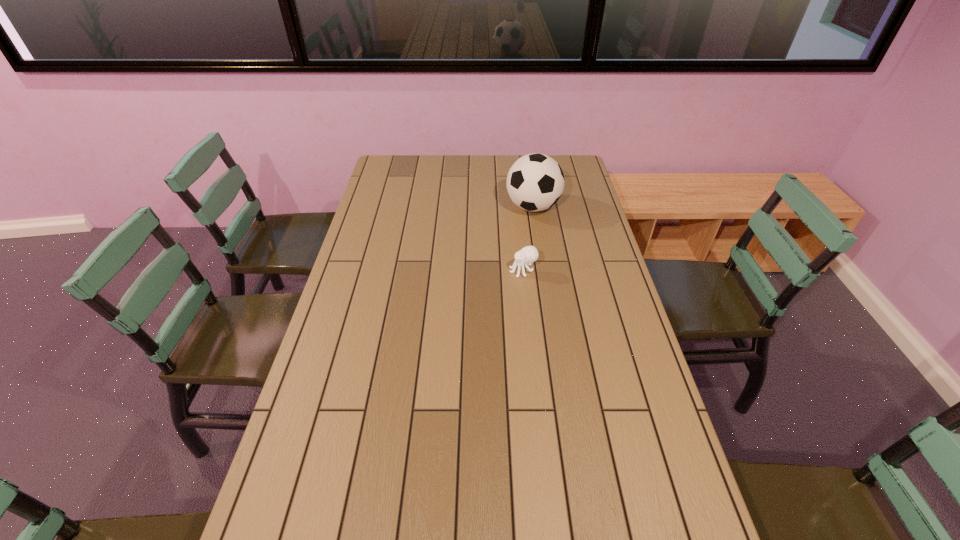
The width and height of the screenshot is (960, 540). I want to click on vacant space at the left edge of the desktop, so click(375, 246).

The width and height of the screenshot is (960, 540). Identify the location of vacant space at the right edge of the desktop. (594, 245).

Where is `free space at the far right corner of the desktop`? free space at the far right corner of the desktop is located at coordinates (569, 171).

What are the coordinates of `vacant region between the octopus and the taller object` in the screenshot? It's located at (528, 239).

What are the coordinates of `free spot between the farther object and the octopus` in the screenshot? It's located at (528, 239).

Where is `free space that satisfies the following two spatial constraints: 1. on the front side of the soccer ball; 2. on the front-facing side of the nearer object`? The height and width of the screenshot is (540, 960). free space that satisfies the following two spatial constraints: 1. on the front side of the soccer ball; 2. on the front-facing side of the nearer object is located at coordinates (543, 271).